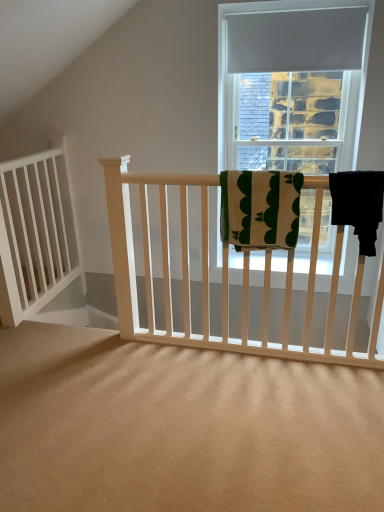
Question: Does white wood balustrade at left have a lesser height compared to matte gray curtain at upper center?

Choices:
 (A) yes
 (B) no

Answer: (B)

Question: From a real-world perspective, is white wood balustrade at left positioned under matte gray curtain at upper center based on gravity?

Choices:
 (A) yes
 (B) no

Answer: (A)

Question: Can you confirm if white wood balustrade at left is thinner than matte gray curtain at upper center?

Choices:
 (A) yes
 (B) no

Answer: (B)

Question: Is the depth of white wood balustrade at left less than that of matte gray curtain at upper center?

Choices:
 (A) no
 (B) yes

Answer: (B)

Question: Does white wood balustrade at left contain matte gray curtain at upper center?

Choices:
 (A) yes
 (B) no

Answer: (B)

Question: In the image, is green cotton towel at center, the 2th beach towel positioned from the right, positioned in front of or behind matte gray curtain at upper center?

Choices:
 (A) front
 (B) behind

Answer: (A)

Question: Looking at the image, does green cotton towel at center, the 2th beach towel positioned from the right, seem bigger or smaller compared to matte gray curtain at upper center?

Choices:
 (A) big
 (B) small

Answer: (A)

Question: Is point (279, 178) positioned closer to the camera than point (357, 18)?

Choices:
 (A) farther
 (B) closer

Answer: (B)

Question: From a real-world perspective, is green cotton towel at center, the first beach towel positioned from the left, above or below matte gray curtain at upper center?

Choices:
 (A) above
 (B) below

Answer: (B)

Question: Is matte gray curtain at upper center in front of or behind white wood balustrade at left in the image?

Choices:
 (A) behind
 (B) front

Answer: (A)

Question: From the image's perspective, relative to white wood balustrade at left, is matte gray curtain at upper center above or below?

Choices:
 (A) below
 (B) above

Answer: (B)

Question: Is point (344, 55) positioned closer to the camera than point (6, 228)?

Choices:
 (A) farther
 (B) closer

Answer: (A)

Question: In terms of width, does matte gray curtain at upper center look wider or thinner when compared to white wood balustrade at left?

Choices:
 (A) thin
 (B) wide

Answer: (A)

Question: Is point (278, 227) positioned closer to the camera than point (41, 173)?

Choices:
 (A) farther
 (B) closer

Answer: (B)

Question: From the image's perspective, is green cotton towel at center, the 2th beach towel positioned from the right, located above or below white wood balustrade at left?

Choices:
 (A) below
 (B) above

Answer: (B)